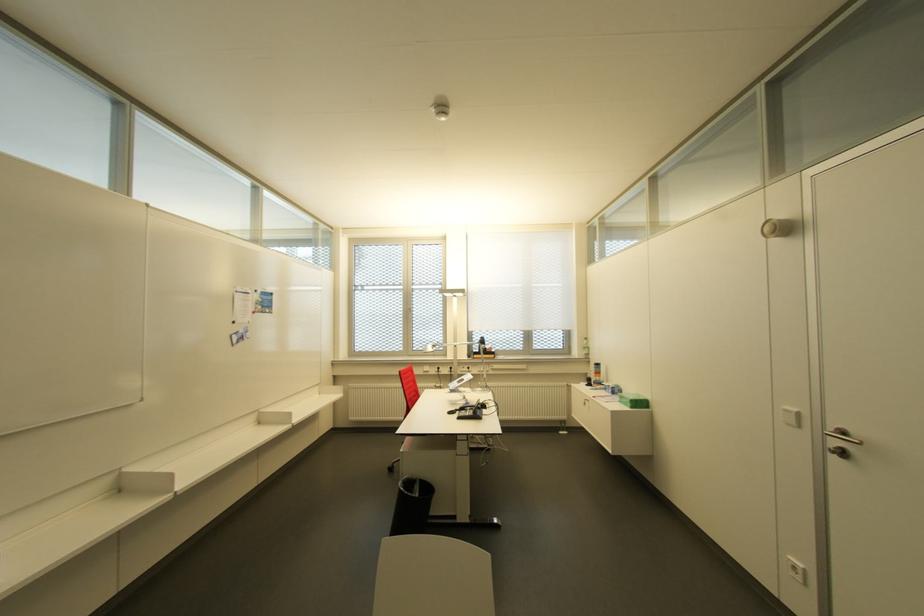
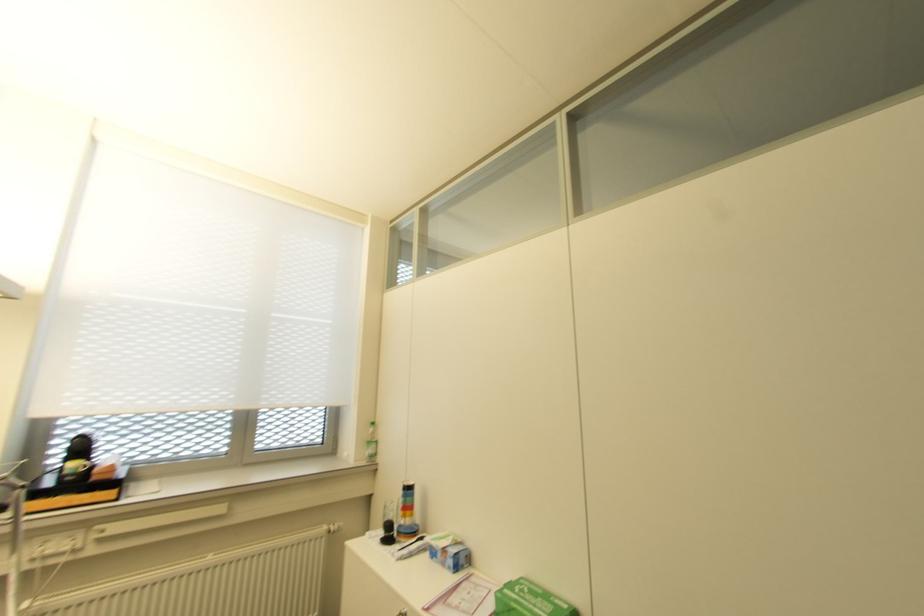
In the second image, find the point that corresponds to pixel 588 386 in the first image.

(385, 540)